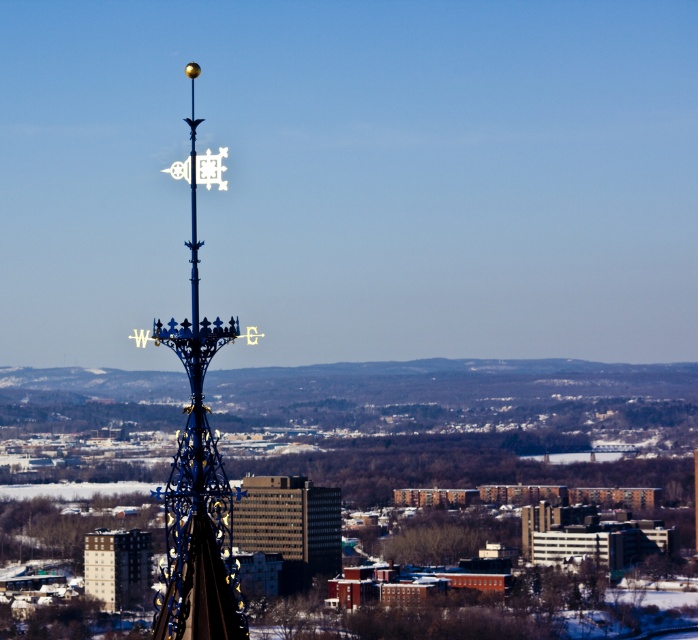
Question: Does polished metal spire at center have a smaller size compared to metallic silver building at lower left?

Choices:
 (A) yes
 (B) no

Answer: (B)

Question: Which point is farther to the camera?

Choices:
 (A) (186, 483)
 (B) (133, 561)

Answer: (B)

Question: Does brown brick building at center appear on the left side of metallic silver building at lower left?

Choices:
 (A) yes
 (B) no

Answer: (B)

Question: Considering the relative positions of polished metal spire at center and brown brick building at center in the image provided, where is polished metal spire at center located with respect to brown brick building at center?

Choices:
 (A) left
 (B) right

Answer: (B)

Question: Which of the following is the farthest from the observer?

Choices:
 (A) brown brick building at center
 (B) metallic silver building at lower left

Answer: (B)

Question: Which point is closer to the camera?

Choices:
 (A) (165, 342)
 (B) (119, 582)

Answer: (A)